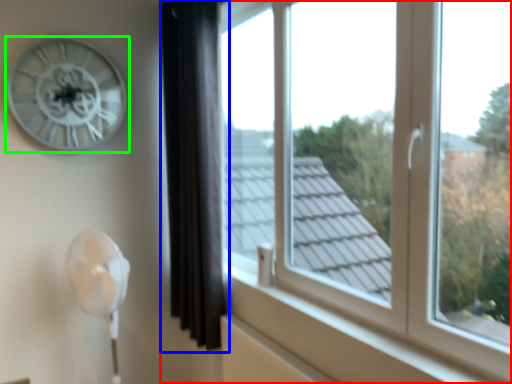
Question: Which object is the farthest from window (highlighted by a red box)? Choose among these: curtain (highlighted by a blue box) or wall clock (highlighted by a green box).

Choices:
 (A) curtain
 (B) wall clock

Answer: (B)